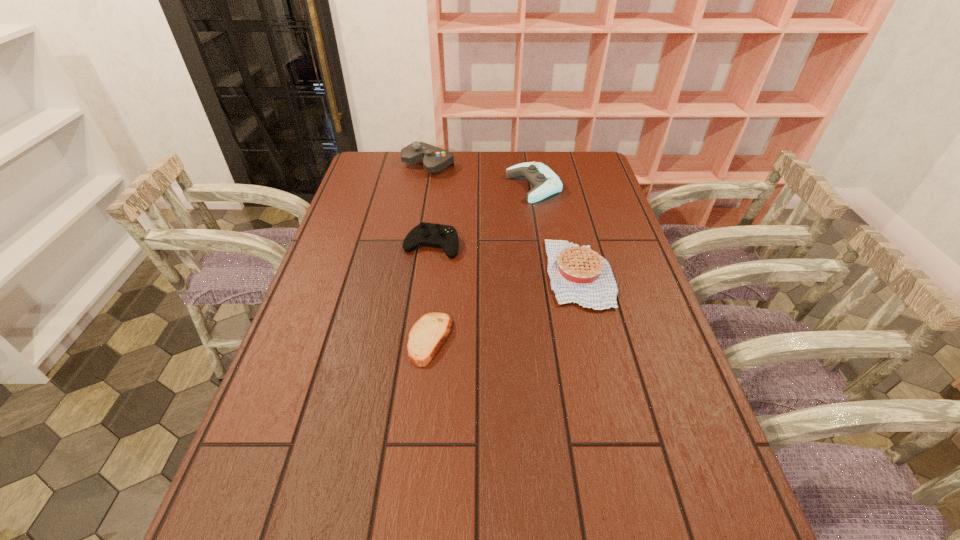
At what (x,y) coordinates should I click in order to perform the action: click on vacant area situated on the back of the nearest object. Please return your answer as a coordinate pair (x, y). The image size is (960, 540). Looking at the image, I should click on (436, 284).

Find the location of a particular element. This screenshot has height=540, width=960. object that is at the left edge is located at coordinates (434, 159).

Find the location of a particular element. This screenshot has height=540, width=960. object positioned at the right edge is located at coordinates (580, 275).

In order to click on object present at the far left corner in this screenshot , I will do `click(434, 159)`.

At what (x,y) coordinates should I click in order to perform the action: click on free region at the far edge of the desktop. Please return your answer as a coordinate pair (x, y). The height and width of the screenshot is (540, 960). Looking at the image, I should click on (457, 166).

Image resolution: width=960 pixels, height=540 pixels. In order to click on free location at the left edge in this screenshot , I will do `click(246, 472)`.

Identify the location of free point at the right edge. Image resolution: width=960 pixels, height=540 pixels. (573, 197).

You are a GUI agent. You are given a task and a screenshot of the screen. Output one action in this format:
    pyautogui.click(x=<x>, y=<y>)
    Task: Click on the vacant space at the far left corner
    
    Given the screenshot: What is the action you would take?
    pyautogui.click(x=371, y=166)

Where is `free space between the nearest control and the pita bread`? Image resolution: width=960 pixels, height=540 pixels. free space between the nearest control and the pita bread is located at coordinates (431, 292).

Locate an element on the screen. The width and height of the screenshot is (960, 540). free space between the nearest control and the tallest object is located at coordinates (430, 205).